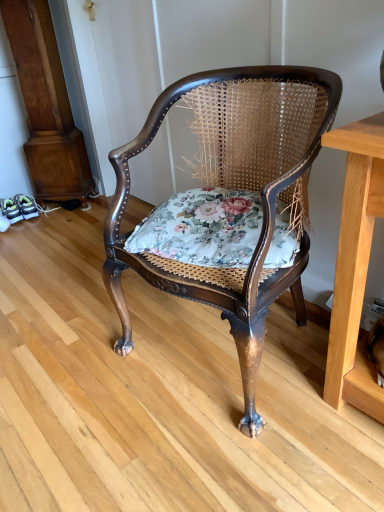
Where is `free location in front of polished wood chair at center`? This screenshot has height=512, width=384. free location in front of polished wood chair at center is located at coordinates (236, 451).